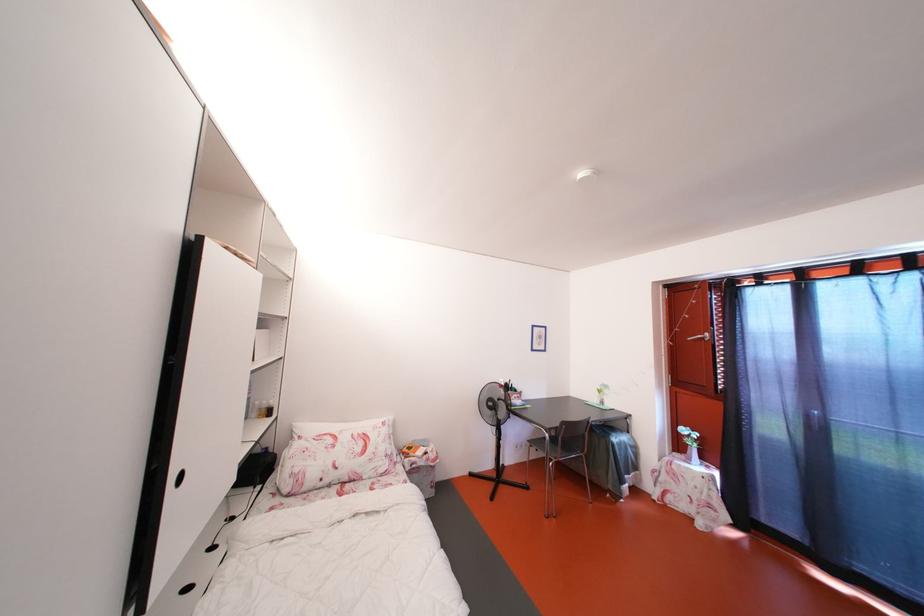
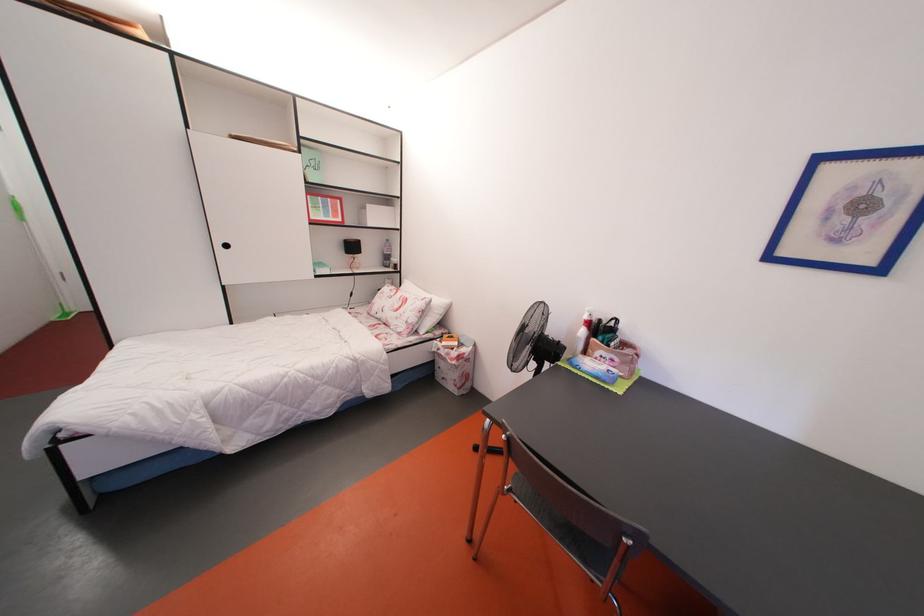
The point at [429,469] is marked in the first image. Where is the corresponding point in the second image?

(450, 360)